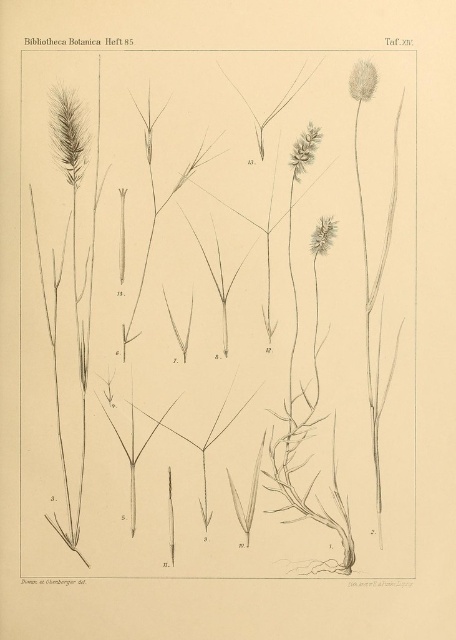
Which is above, silvery textured seed head at upper right or brown textured flower at center?

silvery textured seed head at upper right is higher up.

Between silvery textured seed head at upper right and brown textured flower at center, which one appears on the right side from the viewer's perspective?

silvery textured seed head at upper right is more to the right.

Which is in front, point (367, 97) or point (331, 228)?

Point (367, 97)

Locate an element on the screen. Image resolution: width=456 pixels, height=640 pixels. silvery textured seed head at upper right is located at coordinates (362, 81).

Between brown textured seed head at upper center and brown textured flower at center, which one is positioned higher?

Positioned higher is brown textured seed head at upper center.

I want to click on brown textured seed head at upper center, so click(x=304, y=150).

This screenshot has width=456, height=640. I want to click on brown textured seed head at upper center, so click(x=304, y=150).

Is brown textured seed head at upper center thinner than silvery textured seed head at upper right?

No.

In the scene shown: Does brown textured seed head at upper center come in front of silvery textured seed head at upper right?

No.

What do you see at coordinates (304, 150) in the screenshot? This screenshot has width=456, height=640. I see `brown textured seed head at upper center` at bounding box center [304, 150].

Locate an element on the screen. brown textured seed head at upper center is located at coordinates (304, 150).